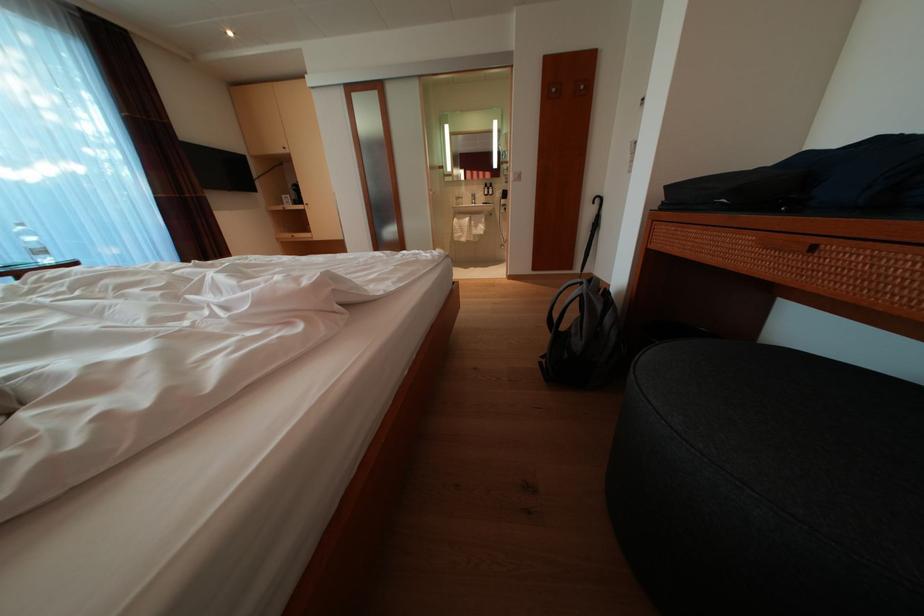
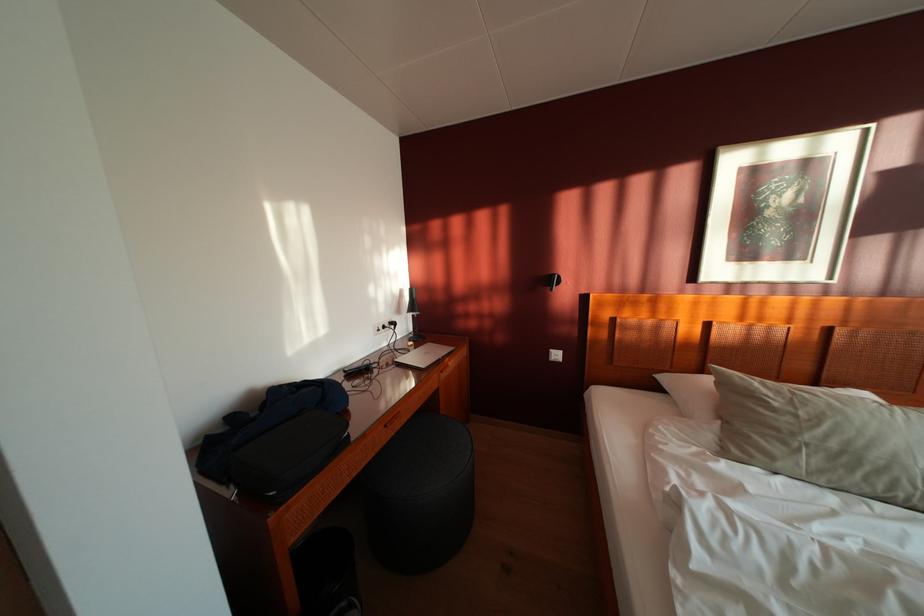
Find the pixel in the second image that matches [659,253] in the first image.

(301, 546)